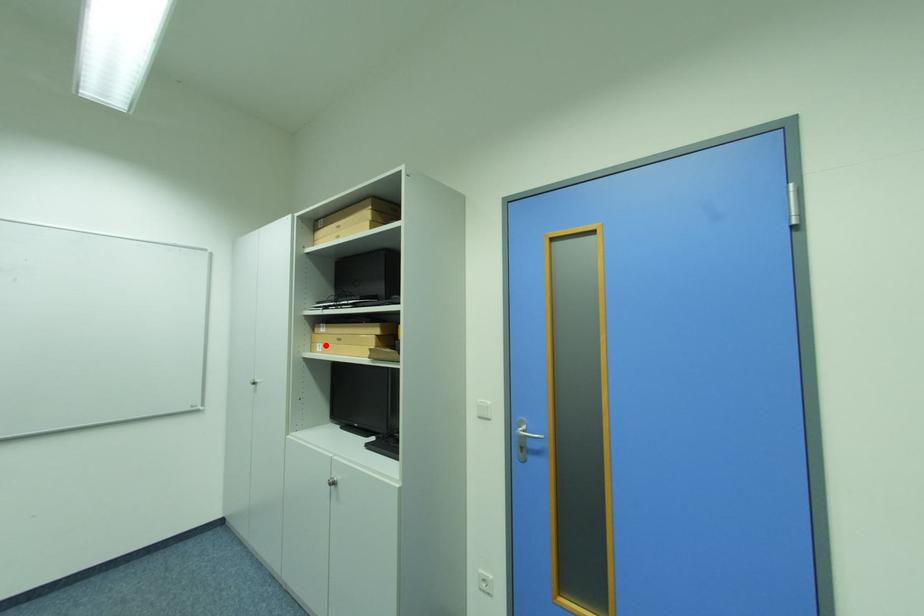
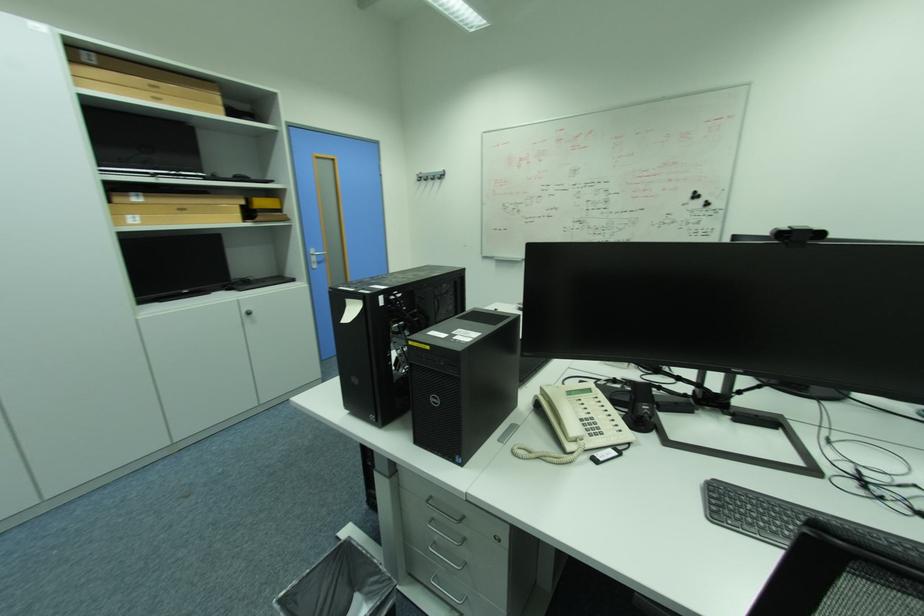
Where in the second image is the point corresponding to the highlighted location from the first image?

(136, 217)